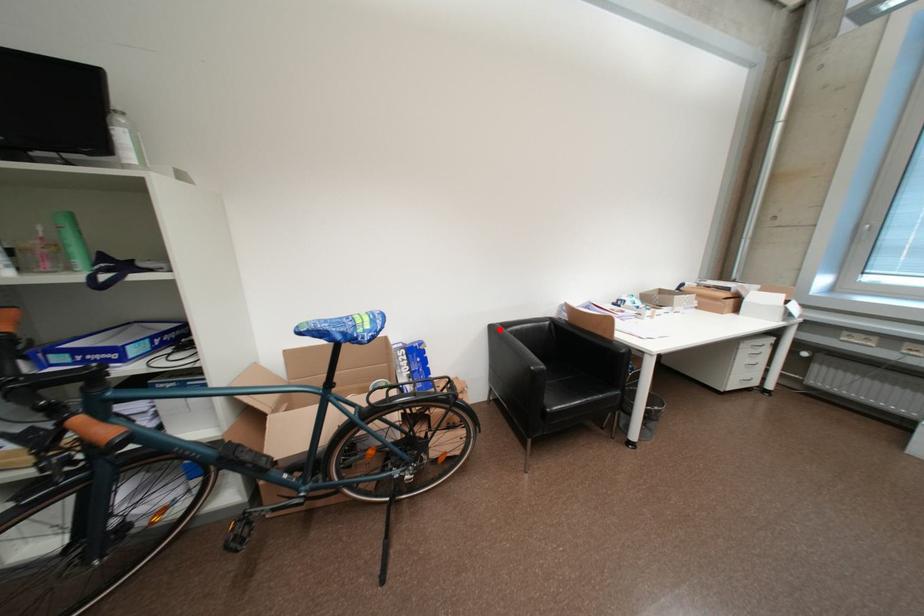
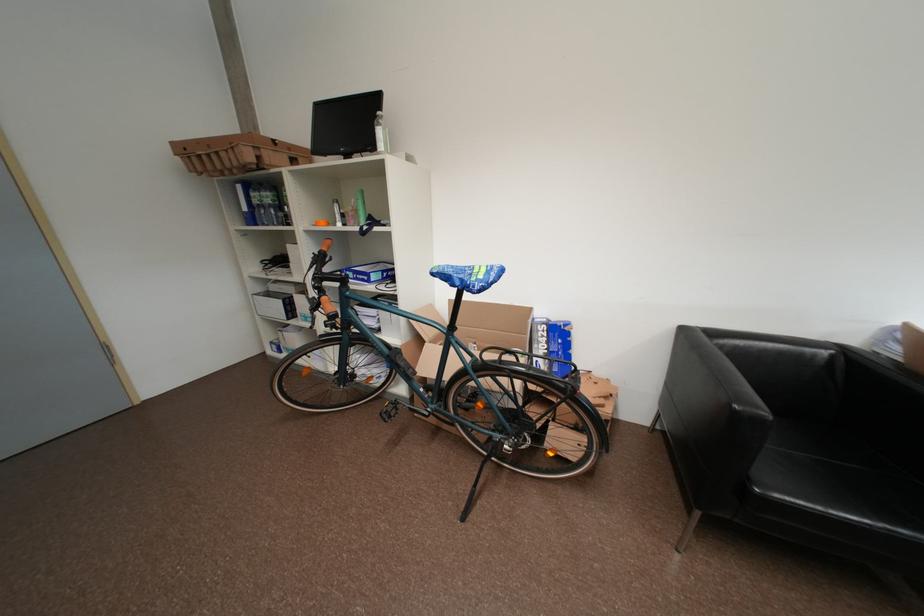
In the second image, find the point that corresponds to the highlighted location in the first image.

(691, 333)